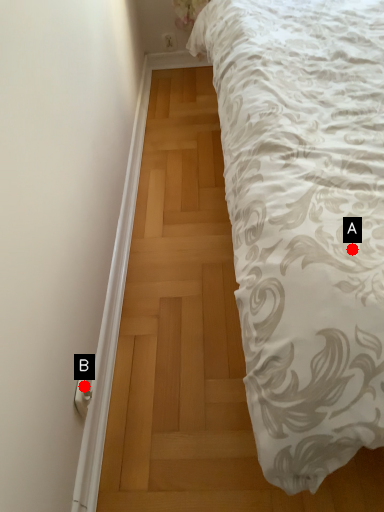
Question: Two points are circled on the image, labeled by A and B beside each circle. Among these points, which one is nearest to the camera?

Choices:
 (A) A is closer
 (B) B is closer

Answer: (A)